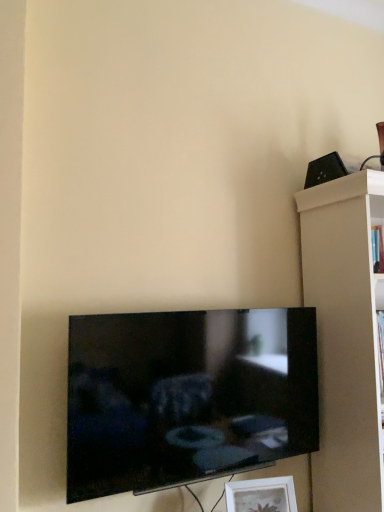
The height and width of the screenshot is (512, 384). Describe the element at coordinates (345, 338) in the screenshot. I see `white matte shelf at right` at that location.

At what (x,y) coordinates should I click in order to perform the action: click on black plastic speaker at upper right. Please return your answer as a coordinate pair (x, y). Looking at the image, I should click on [325, 170].

Would you say white matte shelf at right is outside black glossy tv at lower center?

Yes.

Is white matte shelf at right oriented away from black glossy tv at lower center?

white matte shelf at right is not turned away from black glossy tv at lower center.

Looking at the image, does white matte shelf at right seem bigger or smaller compared to black glossy tv at lower center?

Considering their sizes, white matte shelf at right takes up more space than black glossy tv at lower center.

Do you think black plastic speaker at upper right is within white matte shelf at right, or outside of it?

black plastic speaker at upper right is located beyond the bounds of white matte shelf at right.

Could you tell me if black plastic speaker at upper right is turned towards white matte shelf at right?

No, black plastic speaker at upper right is not facing towards white matte shelf at right.

Is black plastic speaker at upper right smaller than white matte shelf at right?

Yes, black plastic speaker at upper right is smaller than white matte shelf at right.

From the picture: Is black plastic speaker at upper right thinner than white matte shelf at right?

Yes.

Is white matte shelf at right next to white matte picture frame at lower center?

No.

Do you think white matte shelf at right is within white matte picture frame at lower center, or outside of it?

white matte shelf at right is not inside white matte picture frame at lower center, it's outside.

Can you confirm if white matte shelf at right is shorter than white matte picture frame at lower center?

Incorrect, the height of white matte shelf at right does not fall short of that of white matte picture frame at lower center.

Considering the sizes of objects white matte shelf at right and white matte picture frame at lower center in the image provided, who is smaller, white matte shelf at right or white matte picture frame at lower center?

Smaller between the two is white matte picture frame at lower center.

Does black glossy tv at lower center have a lesser height compared to white matte picture frame at lower center?

No.

Is black glossy tv at lower center positioned before white matte picture frame at lower center?

Yes.

From the image's perspective, between black glossy tv at lower center and white matte picture frame at lower center, who is located below?

white matte picture frame at lower center appears lower in the image.

Which of these two, black glossy tv at lower center or white matte picture frame at lower center, is smaller?

Smaller between the two is white matte picture frame at lower center.

Is black plastic speaker at upper right surrounded by black glossy tv at lower center?

No, black plastic speaker at upper right is not inside black glossy tv at lower center.

Could you tell me if black glossy tv at lower center is facing black plastic speaker at upper right?

No, black glossy tv at lower center is not turned towards black plastic speaker at upper right.

Between black glossy tv at lower center and black plastic speaker at upper right, which one has smaller width?

black glossy tv at lower center.

Considering the positions of points (92, 446) and (330, 164), is point (92, 446) farther from camera compared to point (330, 164)?

No, it is not.

Between black plastic speaker at upper right and white matte picture frame at lower center, which one is positioned in front?

white matte picture frame at lower center is in front.

From a real-world perspective, which object rests below the other?

white matte picture frame at lower center.

This screenshot has height=512, width=384. In order to click on picture frame below the black plastic speaker at upper right (from the image's perspective) in this screenshot , I will do `click(261, 495)`.

Is black plastic speaker at upper right oriented towards white matte picture frame at lower center?

No.

Image resolution: width=384 pixels, height=512 pixels. I want to click on shelf located above the black glossy tv at lower center (from the image's perspective), so click(345, 338).

From a real-world perspective, which is physically above, black glossy tv at lower center or white matte shelf at right?

In real-world perspective, white matte shelf at right is above.

Is black glossy tv at lower center looking in the opposite direction of white matte shelf at right?

No, white matte shelf at right is not at the back of black glossy tv at lower center.

Where is `television on the left of the white matte shelf at right`? This screenshot has height=512, width=384. television on the left of the white matte shelf at right is located at coordinates (187, 396).

Image resolution: width=384 pixels, height=512 pixels. Find the location of `speaker behind the white matte shelf at right`. speaker behind the white matte shelf at right is located at coordinates (325, 170).

Estimate the real-world distances between objects in this image. Which object is further from black glossy tv at lower center, white matte picture frame at lower center or black plastic speaker at upper right?

Among the two, black plastic speaker at upper right is located further to black glossy tv at lower center.

Consider the image. From the image, which object appears to be farther from white matte shelf at right, white matte picture frame at lower center or black glossy tv at lower center?

Among the two, white matte picture frame at lower center is located further to white matte shelf at right.

Considering their positions, is black plastic speaker at upper right positioned further to white matte shelf at right than black glossy tv at lower center?

The object further to white matte shelf at right is black plastic speaker at upper right.

Looking at this image, looking at the image, which one is located closer to black glossy tv at lower center, white matte shelf at right or black plastic speaker at upper right?

Based on the image, white matte shelf at right appears to be nearer to black glossy tv at lower center.

Estimate the real-world distances between objects in this image. Which object is further from black glossy tv at lower center, white matte picture frame at lower center or white matte shelf at right?

The object further to black glossy tv at lower center is white matte shelf at right.

When comparing their distances from black plastic speaker at upper right, does black glossy tv at lower center or white matte picture frame at lower center seem closer?

black glossy tv at lower center.

Considering their positions, is white matte shelf at right positioned further to white matte picture frame at lower center than black glossy tv at lower center?

Among the two, white matte shelf at right is located further to white matte picture frame at lower center.

Based on their spatial positions, is black plastic speaker at upper right or white matte picture frame at lower center further from white matte shelf at right?

Among the two, white matte picture frame at lower center is located further to white matte shelf at right.

Where is `television that lies between black plastic speaker at upper right and white matte picture frame at lower center from top to bottom`? The image size is (384, 512). television that lies between black plastic speaker at upper right and white matte picture frame at lower center from top to bottom is located at coordinates (187, 396).

Where is `shelf between black plastic speaker at upper right and white matte picture frame at lower center vertically`? This screenshot has width=384, height=512. shelf between black plastic speaker at upper right and white matte picture frame at lower center vertically is located at coordinates (345, 338).

Where is `picture frame between black glossy tv at lower center and white matte shelf at right from left to right`? The height and width of the screenshot is (512, 384). picture frame between black glossy tv at lower center and white matte shelf at right from left to right is located at coordinates (261, 495).

Find the location of a particular element. The height and width of the screenshot is (512, 384). shelf that lies between black plastic speaker at upper right and black glossy tv at lower center from top to bottom is located at coordinates (345, 338).